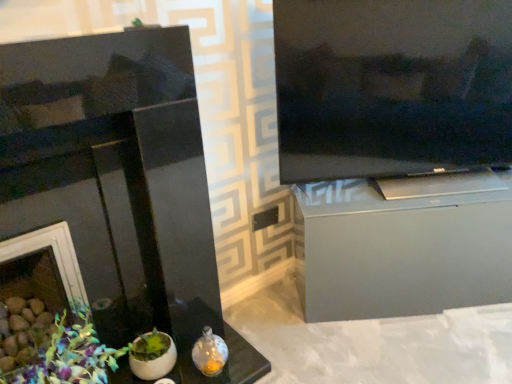
Find the location of a particular element. The height and width of the screenshot is (384, 512). vacant space underneath black glossy television at upper right (from a real-world perspective) is located at coordinates [x=398, y=190].